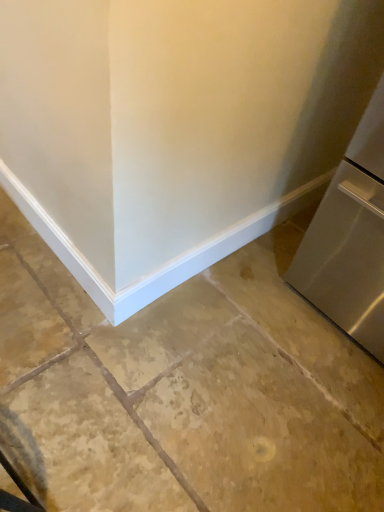
Question: From a real-world perspective, relative to brown stone floor at center, is satin silver refrigerator at right vertically above or below?

Choices:
 (A) above
 (B) below

Answer: (A)

Question: Is satin silver refrigerator at right in front of or behind brown stone floor at center in the image?

Choices:
 (A) front
 (B) behind

Answer: (A)

Question: Is satin silver refrigerator at right spatially inside brown stone floor at center, or outside of it?

Choices:
 (A) inside
 (B) outside

Answer: (B)

Question: In terms of width, does brown stone floor at center look wider or thinner when compared to satin silver refrigerator at right?

Choices:
 (A) thin
 (B) wide

Answer: (B)

Question: Is brown stone floor at center taller or shorter than satin silver refrigerator at right?

Choices:
 (A) short
 (B) tall

Answer: (A)

Question: Visually, is brown stone floor at center positioned to the left or to the right of satin silver refrigerator at right?

Choices:
 (A) left
 (B) right

Answer: (A)

Question: In the image, is brown stone floor at center positioned in front of or behind satin silver refrigerator at right?

Choices:
 (A) behind
 (B) front

Answer: (A)